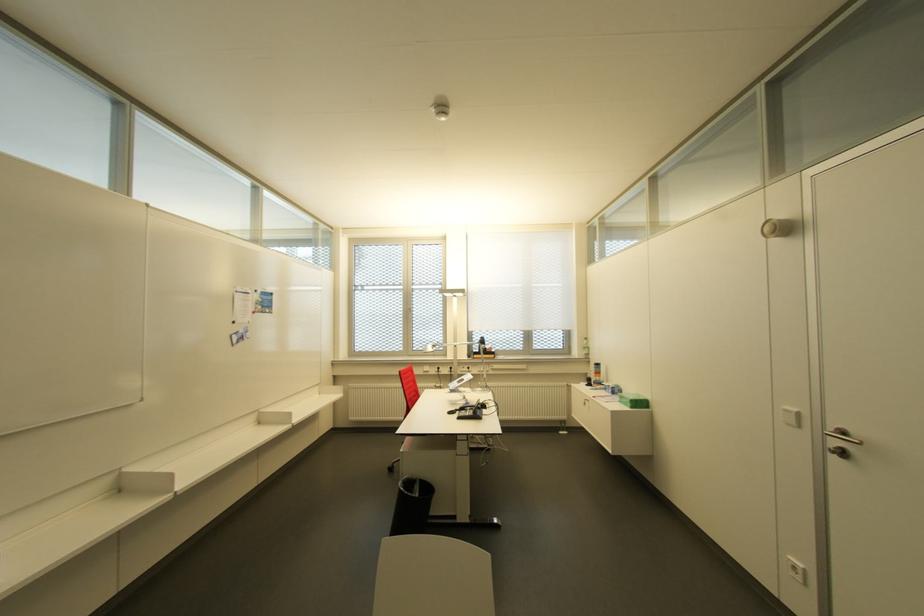
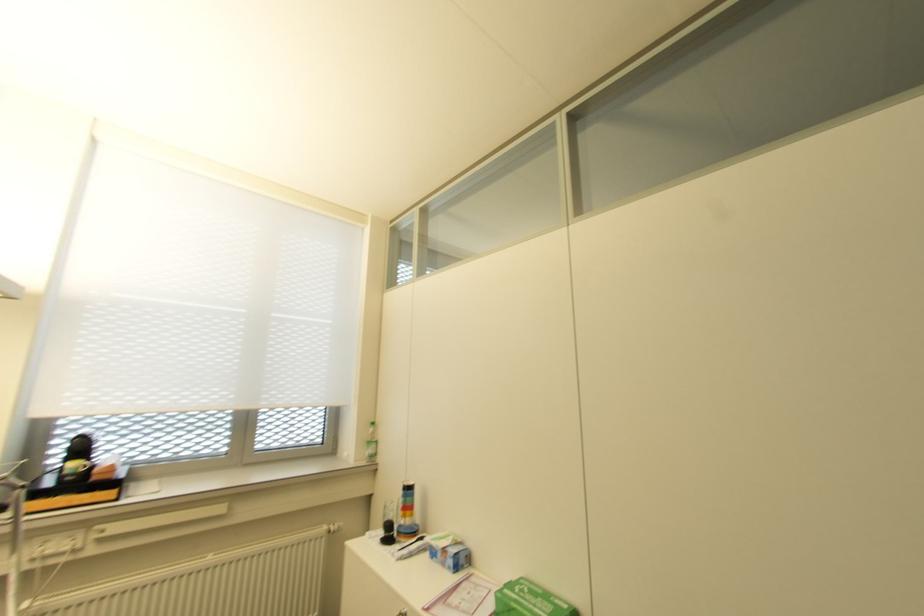
Find the pixel in the second image that matches the point at 640,399 in the first image.

(563, 605)